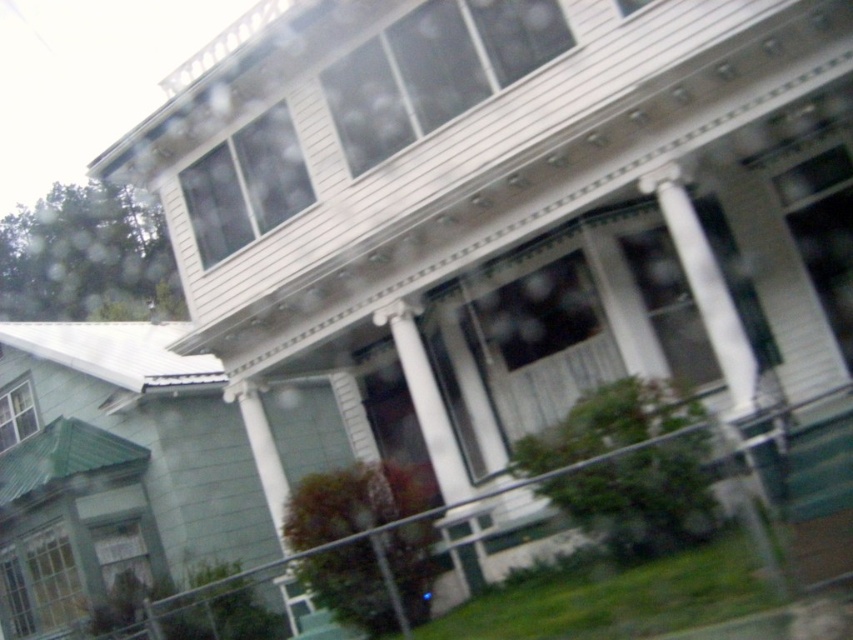
Which of these two, white wood porch at center or white smooth column at center, stands shorter?

white smooth column at center is shorter.

Is white wood porch at center to the right of white smooth column at center from the viewer's perspective?

In fact, white wood porch at center is to the left of white smooth column at center.

Is point (471, 499) behind point (692, 262)?

Yes.

You are a GUI agent. You are given a task and a screenshot of the screen. Output one action in this format:
    pyautogui.click(x=<x>, y=<y>)
    Task: Click on the white wood porch at center
    
    Given the screenshot: What is the action you would take?
    pyautogui.click(x=439, y=513)

Between point (370, 125) and point (701, 269), which one is positioned in front?

Point (701, 269) is more forward.

Is point (436, 81) more distant than point (726, 358)?

Yes, point (436, 81) is farther from viewer.

Identify the location of transparent glass window at upper center. (434, 68).

Is transparent glass window at upper center to the left of transparent glass car window at center from the viewer's perspective?

Answer: Yes, transparent glass window at upper center is to the left of transparent glass car window at center.

Looking at this image, who is positioned more to the left, transparent glass window at upper center or transparent glass car window at center?

transparent glass window at upper center

Locate an element on the screen. transparent glass window at upper center is located at coordinates (434, 68).